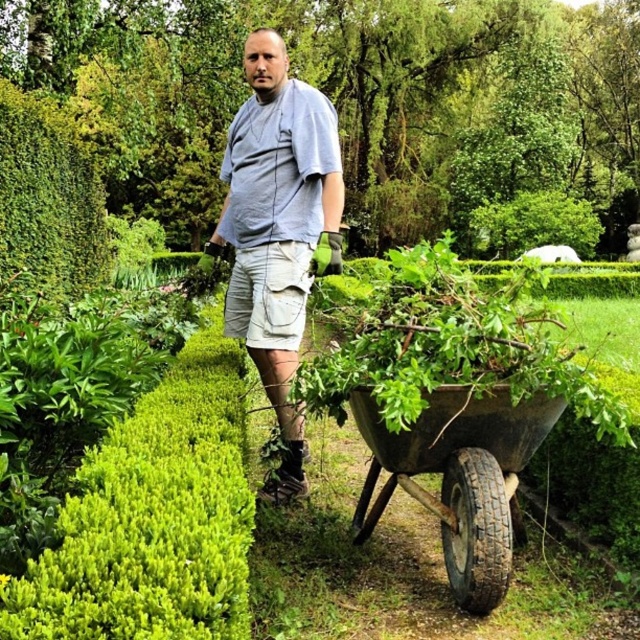
Is green leafy bush at center above rusty metal wheelbarrow at lower right?

Yes.

Is green leafy bush at center bigger than rusty metal wheelbarrow at lower right?

Yes.

Between point (198, 342) and point (508, 515), which one is positioned in front?

Point (508, 515)

Find the location of a particular element. This screenshot has height=640, width=640. green leafy bush at center is located at coordinates (154, 518).

You are a GUI agent. You are given a task and a screenshot of the screen. Output one action in this format:
    pyautogui.click(x=<x>, y=<y>)
    Task: Click on the green leafy bush at center
    
    Given the screenshot: What is the action you would take?
    pyautogui.click(x=154, y=518)

Does point (156, 438) come farther from viewer compared to point (259, 56)?

No, (156, 438) is closer to viewer.

Is point (241, 538) positioned after point (262, 52)?

That is False.

Where is `green leafy bush at center`? green leafy bush at center is located at coordinates (154, 518).

Who is lower down, gray cotton shirt at center or rusty metal wheelbarrow at lower right?

Positioned lower is rusty metal wheelbarrow at lower right.

Does gray cotton shirt at center have a greater width compared to rusty metal wheelbarrow at lower right?

In fact, gray cotton shirt at center might be narrower than rusty metal wheelbarrow at lower right.

The height and width of the screenshot is (640, 640). I want to click on gray cotton shirt at center, so click(276, 227).